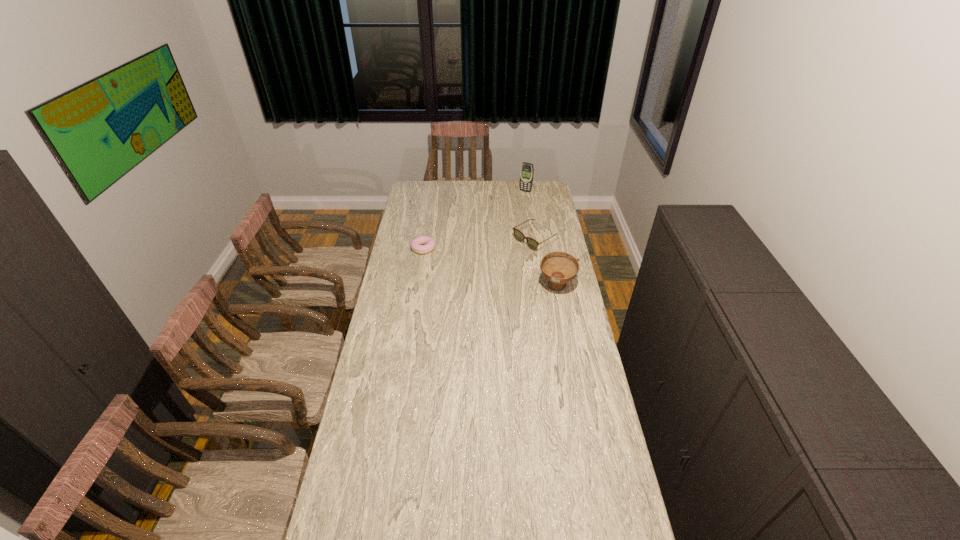
You are a GUI agent. You are given a task and a screenshot of the screen. Output one action in this format:
    pyautogui.click(x=<x>, y=<y>)
    Task: Click on the object located at the far right corner
    The image size is (960, 540).
    Given the screenshot: What is the action you would take?
    pyautogui.click(x=527, y=170)

Image resolution: width=960 pixels, height=540 pixels. I want to click on blank space at the far edge, so click(x=505, y=196).

This screenshot has width=960, height=540. Find the location of `vacant space at the left edge of the desktop`. vacant space at the left edge of the desktop is located at coordinates (397, 233).

Where is `free space at the right edge of the desktop`? free space at the right edge of the desktop is located at coordinates (579, 304).

Identify the location of vacant region at the near left corner. The image size is (960, 540). (326, 532).

The width and height of the screenshot is (960, 540). In order to click on free space at the far right corner of the desktop in this screenshot , I will do `click(548, 193)`.

Find the location of a particular element. The width and height of the screenshot is (960, 540). vacant area that lies between the cellular telephone and the second tallest object is located at coordinates coord(540,239).

Where is `free spot between the farthest object and the doughnut`? free spot between the farthest object and the doughnut is located at coordinates (474, 220).

Where is `unoccupied position between the leftmost object and the spectacles`? unoccupied position between the leftmost object and the spectacles is located at coordinates (479, 244).

This screenshot has height=540, width=960. Identify the location of unoccupied area between the third tallest object and the cellular telephone. (531, 215).